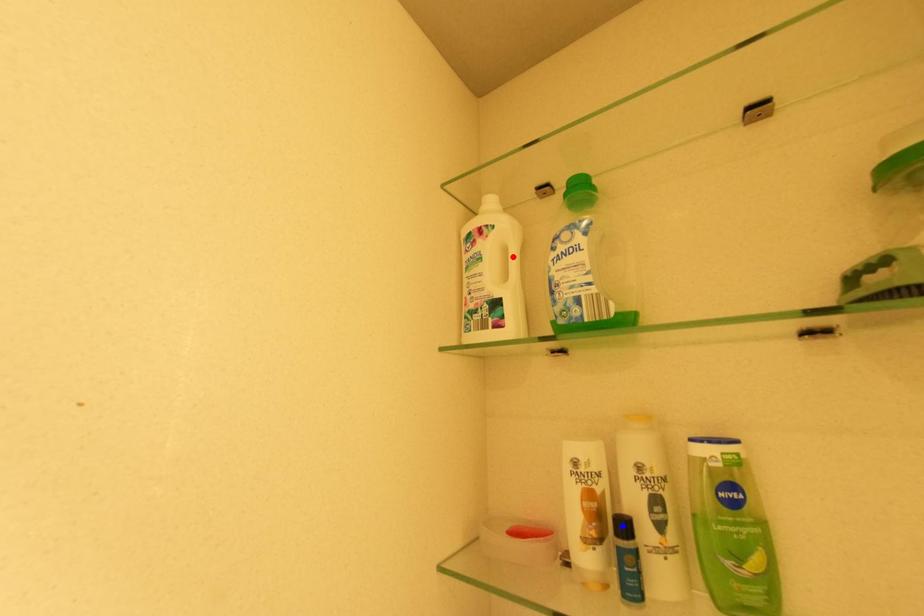
Question: Two points are marked on the image. Which point is closer to the camera?

Choices:
 (A) Blue point is closer.
 (B) Red point is closer.

Answer: (A)